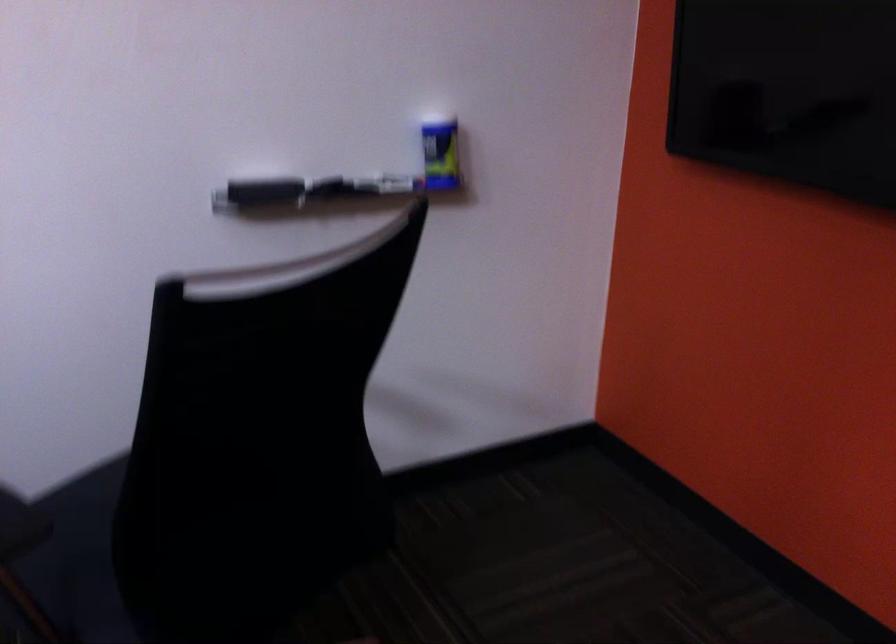
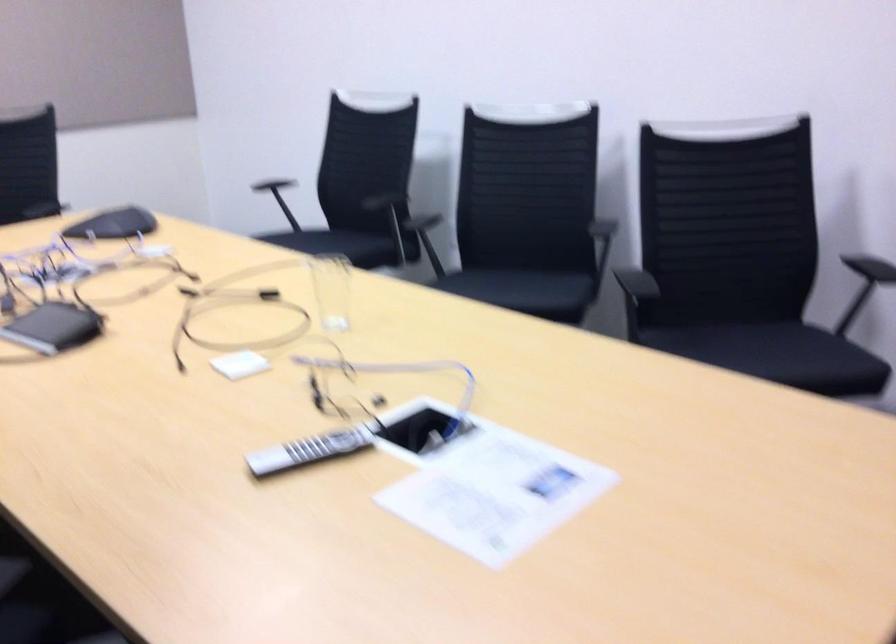
Question: The camera is either moving clockwise (left) or counter-clockwise (right) around the object. The first image is from the beginning of the video and the second image is from the end. Is the camera moving left or right when shooting the video?

Choices:
 (A) Left
 (B) Right

Answer: (B)